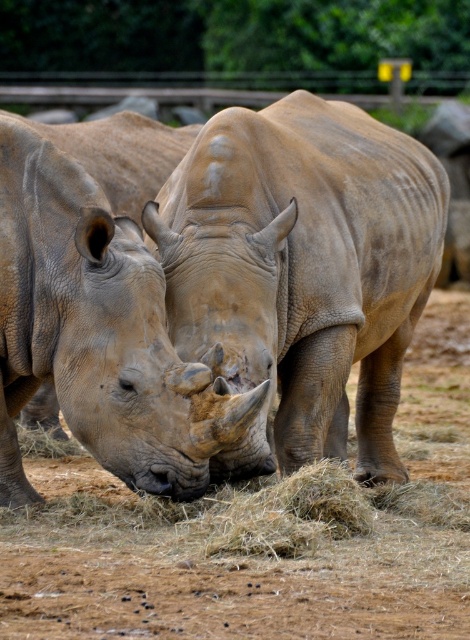
Does point (54, 600) come farther from viewer compared to point (352, 109)?

No, it is in front of (352, 109).

Between point (427, 385) and point (390, 259), which one is positioned in front?

Point (390, 259) is in front.

Locate an element on the screen. brown dirt field at center is located at coordinates (263, 536).

Based on the photo, between smooth beige rhino at center and smooth beige rhino at left, which one is positioned lower?

smooth beige rhino at left is lower down.

Can you confirm if smooth beige rhino at center is bigger than smooth beige rhino at left?

Correct, smooth beige rhino at center is larger in size than smooth beige rhino at left.

Which is behind, point (245, 364) or point (225, 428)?

The point (245, 364) is behind.

This screenshot has width=470, height=640. Identify the location of smooth beige rhino at center. (304, 266).

Does brown dirt field at center have a lesser width compared to smooth beige rhino at left?

Incorrect, brown dirt field at center's width is not less than smooth beige rhino at left's.

Describe the element at coordinates (263, 536) in the screenshot. This screenshot has width=470, height=640. I see `brown dirt field at center` at that location.

Does point (407, 436) come in front of point (187, 435)?

No, it is behind (187, 435).

Locate an element on the screen. brown dirt field at center is located at coordinates (263, 536).